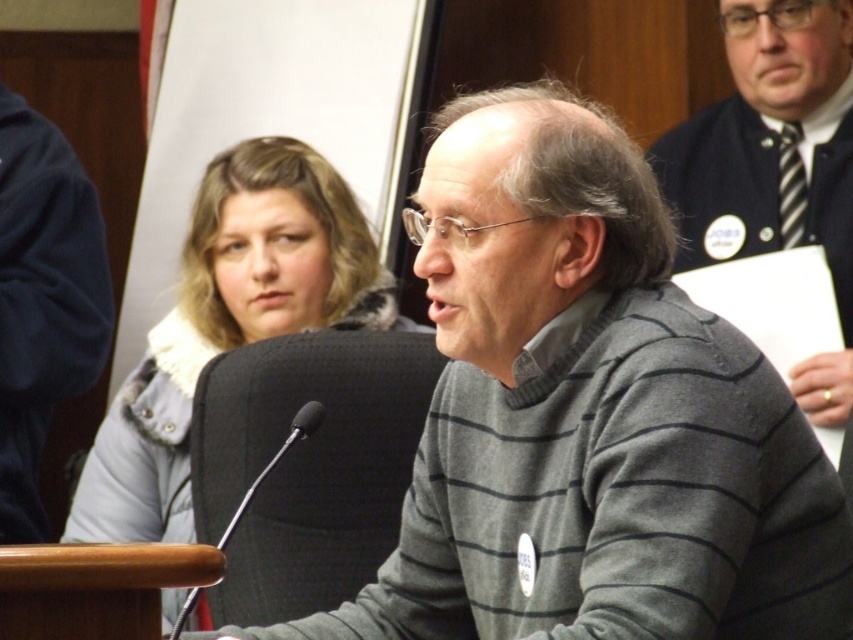
Question: Does gray striped sweater at center appear on the left side of striped sweater at upper right?

Choices:
 (A) no
 (B) yes

Answer: (B)

Question: Is gray striped sweater at center positioned at the back of gray fur-trimmed coat at upper center?

Choices:
 (A) no
 (B) yes

Answer: (A)

Question: Among these objects, which one is nearest to the camera?

Choices:
 (A) gray striped sweater at center
 (B) striped sweater at upper right
 (C) gray fur-trimmed coat at upper center

Answer: (A)

Question: Is gray fur-trimmed coat at upper center below striped sweater at upper right?

Choices:
 (A) yes
 (B) no

Answer: (A)

Question: Estimate the real-world distances between objects in this image. Which object is farther from the gray striped sweater at center?

Choices:
 (A) striped sweater at upper right
 (B) gray fur-trimmed coat at upper center

Answer: (A)

Question: Among these points, which one is nearest to the camera?

Choices:
 (A) (770, 116)
 (B) (509, 410)

Answer: (B)